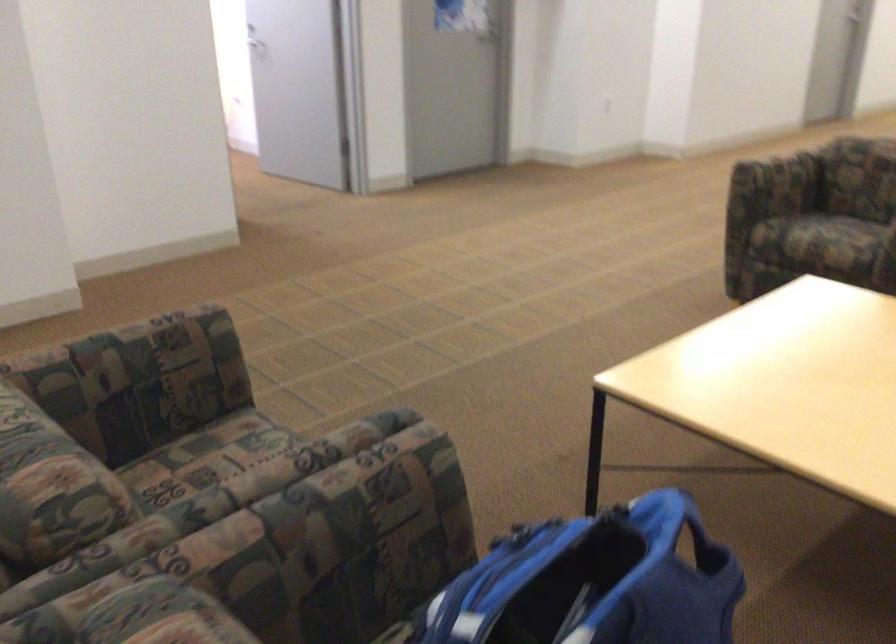
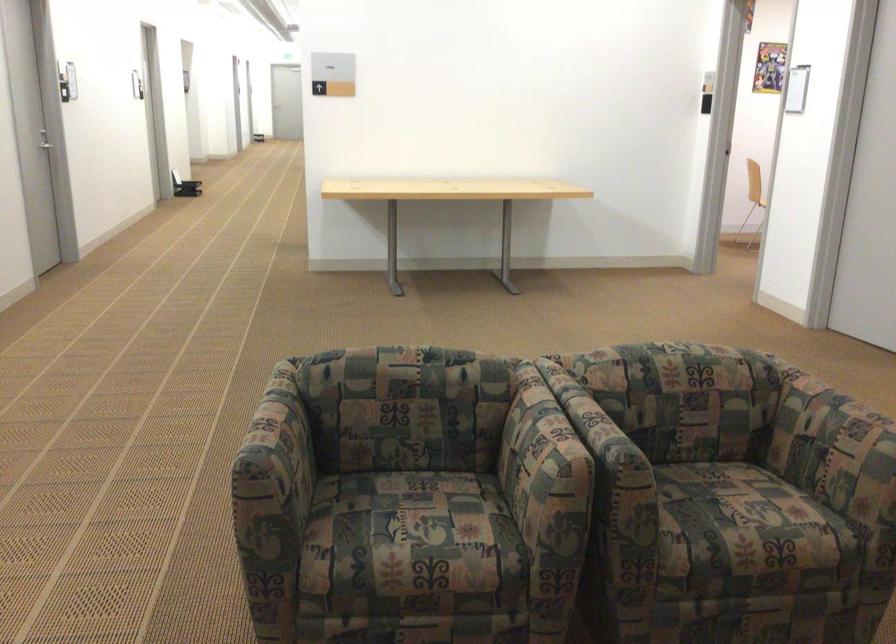
The point at (819,214) is marked in the first image. Where is the corresponding point in the second image?

(417, 521)